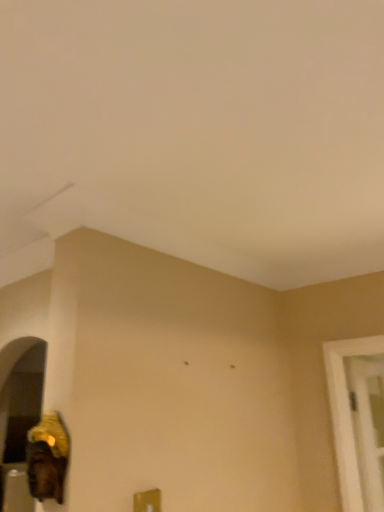
The width and height of the screenshot is (384, 512). What do you see at coordinates (47, 458) in the screenshot?
I see `gold metallic figurine at lower left` at bounding box center [47, 458].

The width and height of the screenshot is (384, 512). Identify the location of gold metallic figurine at lower left. (47, 458).

What is the approximate height of gold metallic figurine at lower left?

gold metallic figurine at lower left is 8.88 inches in height.

I want to click on gold metallic figurine at lower left, so click(x=47, y=458).